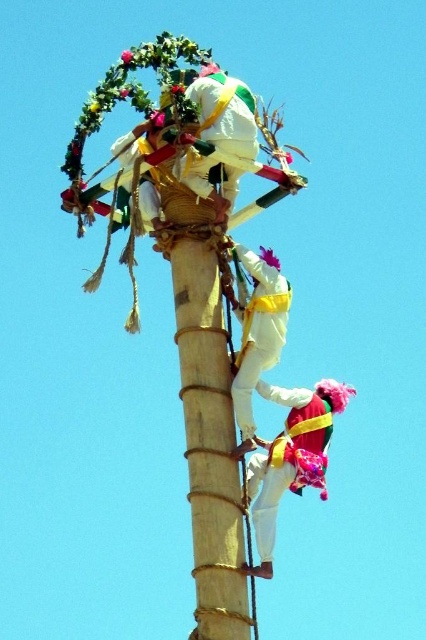
What do you see at coordinates (218, 134) in the screenshot? I see `white matte fabric at upper center` at bounding box center [218, 134].

Identify the location of white matte fabric at upper center. This screenshot has height=640, width=426. (218, 134).

Can you confirm if bamboo pole at center is wider than white matte climbing harness at center?

Indeed, bamboo pole at center has a greater width compared to white matte climbing harness at center.

Can you confirm if bamboo pole at center is smaller than white matte climbing harness at center?

Actually, bamboo pole at center might be larger than white matte climbing harness at center.

Is point (195, 616) positioned behind point (236, 368)?

No, it is not.

The height and width of the screenshot is (640, 426). I want to click on bamboo pole at center, so click(x=210, y=444).

Which of these two, bamboo pole at center or white matte fabric at upper center, stands taller?

bamboo pole at center is taller.

Is bamboo pole at center wider than white matte fabric at upper center?

In fact, bamboo pole at center might be narrower than white matte fabric at upper center.

This screenshot has height=640, width=426. In order to click on bamboo pole at center in this screenshot , I will do `click(210, 444)`.

Identify the location of bamboo pole at center. (210, 444).